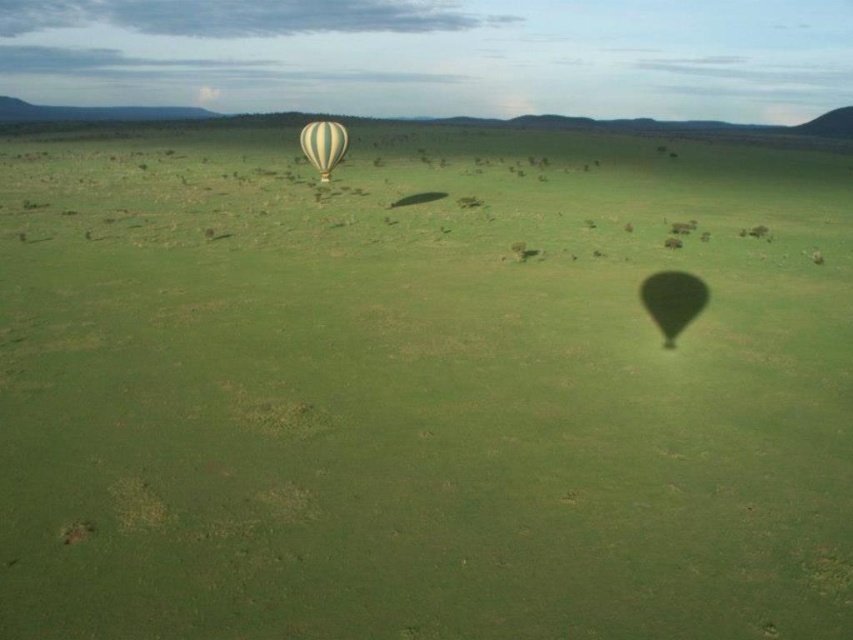
Looking at this image, can you confirm if translucent yellow balloon at lower right is bigger than yellow striped fabric balloon at center?

Actually, translucent yellow balloon at lower right might be smaller than yellow striped fabric balloon at center.

Is point (695, 291) closer to viewer compared to point (321, 144)?

Yes, it is in front of point (321, 144).

Measure the distance between point (643, 300) and camera.

Point (643, 300) and camera are 12.27 meters apart.

In order to click on translucent yellow balloon at lower right in this screenshot , I will do `click(672, 301)`.